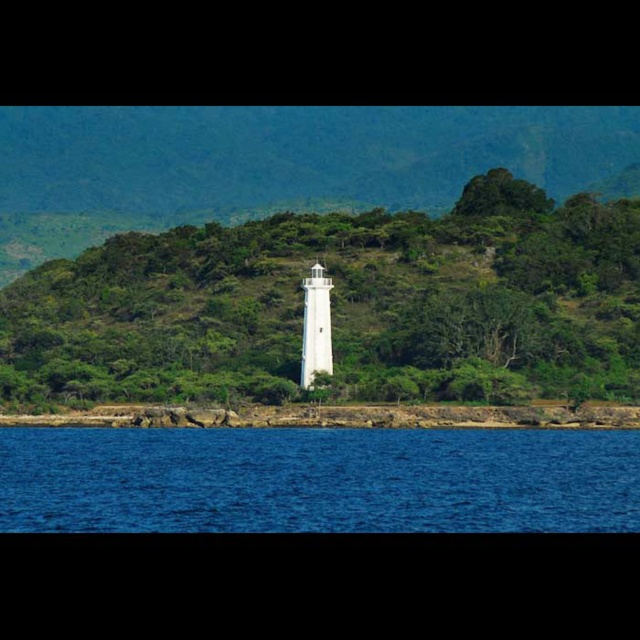
Does white smooth lighthouse at center come in front of white matte/light tower at center?

No, white smooth lighthouse at center is further to the viewer.

Between point (397, 364) and point (326, 285), which one is positioned in front?

Point (326, 285)

Where is `white smooth lighthouse at center`? white smooth lighthouse at center is located at coordinates click(342, 305).

Is white smooth lighthouse at center positioned before blue liquid water at lower center?

No, it is not.

Can you confirm if white smooth lighthouse at center is shorter than blue liquid water at lower center?

In fact, white smooth lighthouse at center may be taller than blue liquid water at lower center.

I want to click on white smooth lighthouse at center, so click(342, 305).

Identify the location of white smooth lighthouse at center. [342, 305].

Is blue liquid water at lower center above white matte/light tower at center?

No.

Can you confirm if blue liquid water at lower center is bigger than white matte/light tower at center?

Yes.

Between point (524, 516) and point (324, 317), which one is positioned behind?

Positioned behind is point (324, 317).

Identify the location of blue liquid water at lower center. Image resolution: width=640 pixels, height=640 pixels. (317, 481).